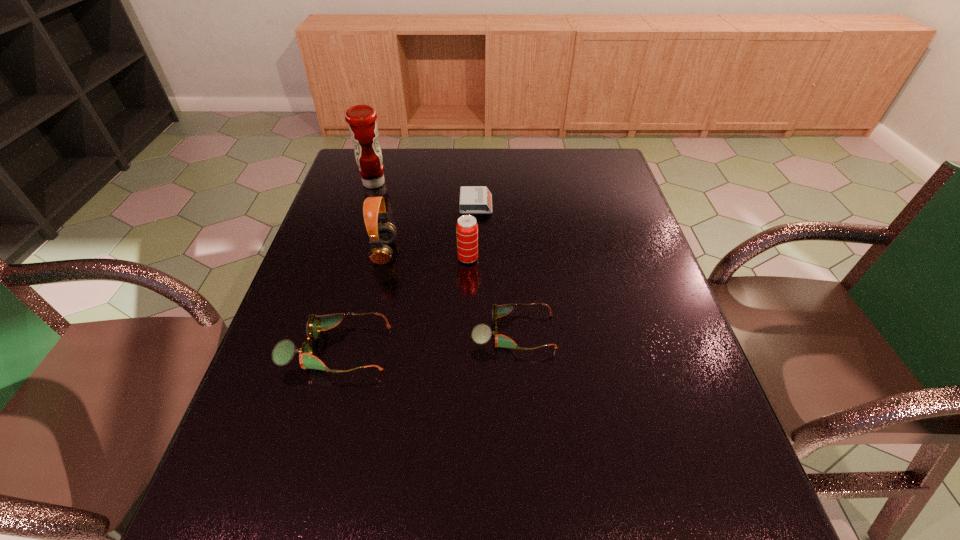
The height and width of the screenshot is (540, 960). I want to click on vacant space located 0.200m on the front-facing side of the taller spectacles, so click(x=479, y=349).

In order to click on vacant area located 0.160m on the front-facing side of the second shortest object in this screenshot , I will do `click(626, 332)`.

Where is `free space located on the right of the tallest object`? Image resolution: width=960 pixels, height=540 pixels. free space located on the right of the tallest object is located at coordinates (503, 183).

Image resolution: width=960 pixels, height=540 pixels. I want to click on blank space located 0.380m on the right of the second farthest object, so click(x=617, y=205).

Where is `vacant space located on the ear cups of the headset`? This screenshot has height=540, width=960. vacant space located on the ear cups of the headset is located at coordinates (492, 252).

Where is `free space located on the back of the third tallest object`? free space located on the back of the third tallest object is located at coordinates (469, 194).

You are a GUI agent. You are given a task and a screenshot of the screen. Output one action in this format:
    pyautogui.click(x=<x>, y=<y>)
    Task: Click on the object that is at the far edge
    The image size is (960, 540).
    Given the screenshot: What is the action you would take?
    pyautogui.click(x=363, y=128)

Locate an element on the screen. spectacles present at the left edge is located at coordinates (283, 352).

This screenshot has width=960, height=540. What are the coordinates of `condiment present at the left edge` in the screenshot? It's located at (363, 128).

The height and width of the screenshot is (540, 960). I want to click on object that is at the far left corner, so click(363, 128).